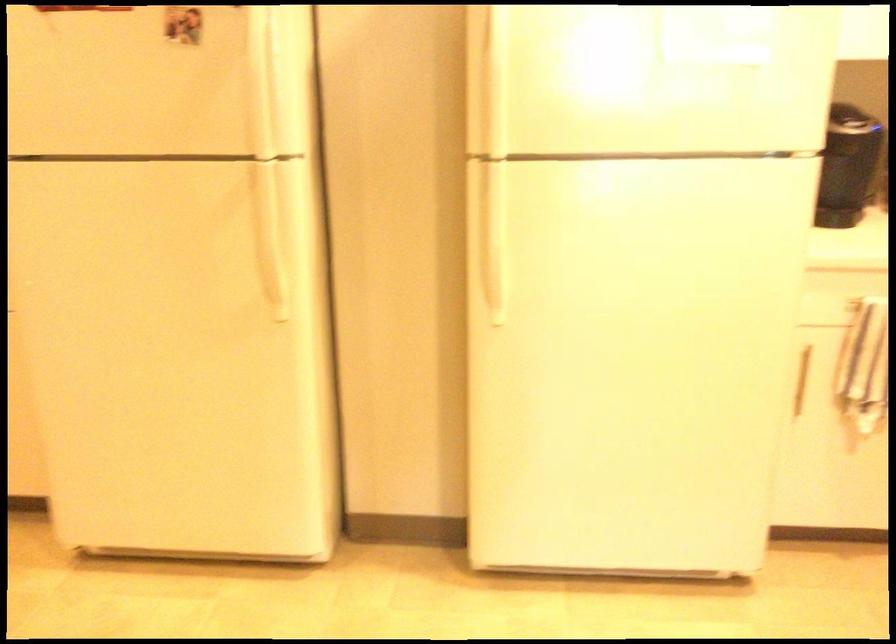
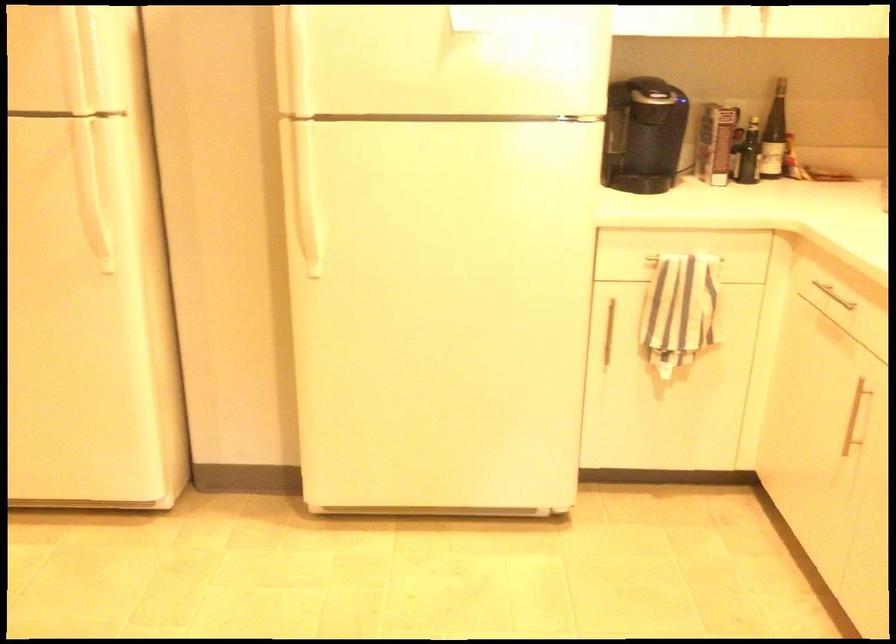
In a continuous first-person perspective shot, in which direction is the camera moving?

The cameraman moved toward right, backward.